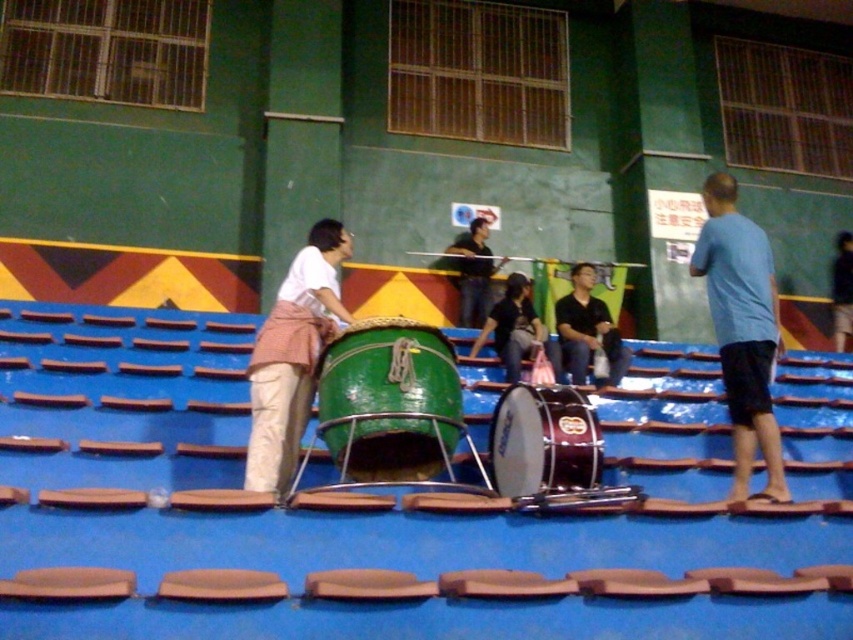
From the picture: You are standing at the entrance of the gymnasium and see two points marked in the scene. Which point is closer to you, point (x=767, y=458) or point (x=518, y=300)?

Point (x=767, y=458) is in front of point (x=518, y=300), so it is closer to you.

You are standing in the gymnasium and notice two people wearing blue shirts. The blue cotton shirt at right and the dark blue shirt at center. Which person is taller?

The blue cotton shirt at right is much taller than the dark blue shirt at center.